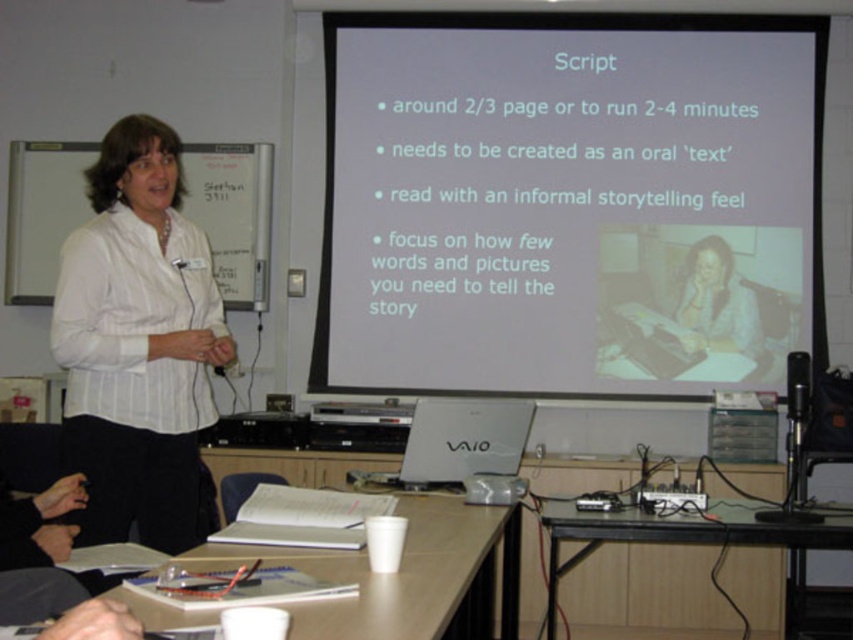
Question: Is transparent glass table at center below silver metallic laptop at center?

Choices:
 (A) no
 (B) yes

Answer: (B)

Question: Which point appears closest to the camera in this image?

Choices:
 (A) (639, 492)
 (B) (735, 349)
 (C) (564, 74)

Answer: (A)

Question: Can you confirm if white plastic table at lower center is thinner than transparent glass table at center?

Choices:
 (A) no
 (B) yes

Answer: (B)

Question: Does white shirt at center have a greater width compared to black plastic projector at center?

Choices:
 (A) yes
 (B) no

Answer: (A)

Question: Among these objects, which one is nearest to the camera?

Choices:
 (A) white shirt at center
 (B) light brown hair at upper right
 (C) transparent glass table at center

Answer: (A)

Question: Which object is positioned farthest from the silver metallic laptop at center?

Choices:
 (A) black plastic projector at center
 (B) light brown hair at upper right

Answer: (B)